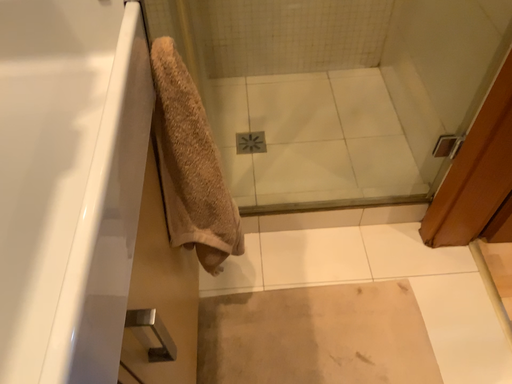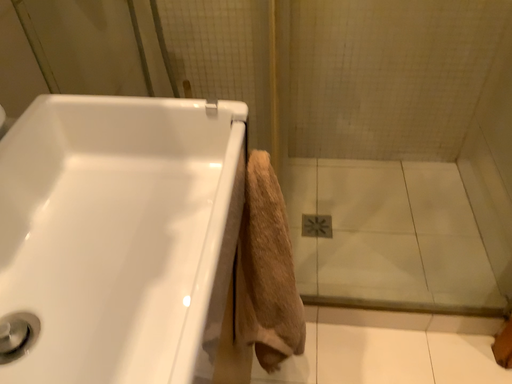
Question: How did the camera likely rotate when shooting the video?

Choices:
 (A) rotated downward
 (B) rotated upward

Answer: (B)